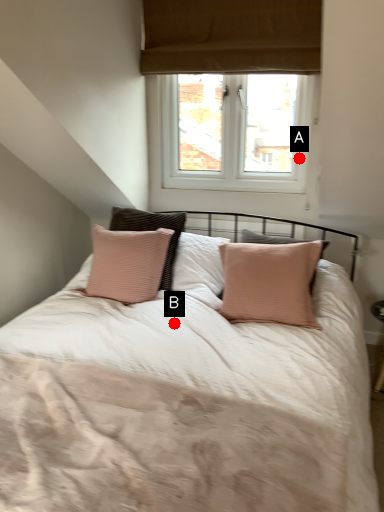
Question: Two points are circled on the image, labeled by A and B beside each circle. Which point is closer to the camera?

Choices:
 (A) A is closer
 (B) B is closer

Answer: (B)